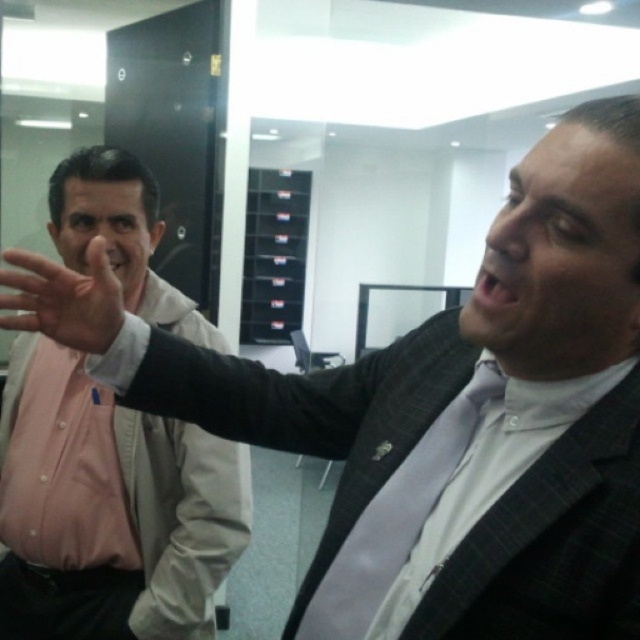
Question: Is pink shirt at left further to the viewer compared to matte skin hand at center?

Choices:
 (A) no
 (B) yes

Answer: (B)

Question: Observing the image, what is the correct spatial positioning of pink shirt at left in reference to matte skin hand at center?

Choices:
 (A) below
 (B) above

Answer: (A)

Question: Is pink shirt at left to the left of matte skin hand at center from the viewer's perspective?

Choices:
 (A) yes
 (B) no

Answer: (A)